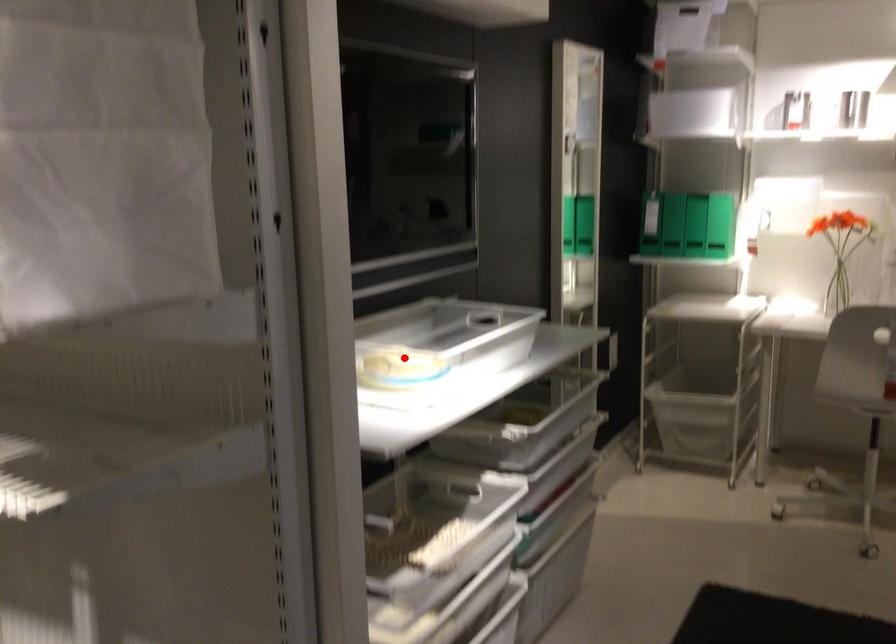
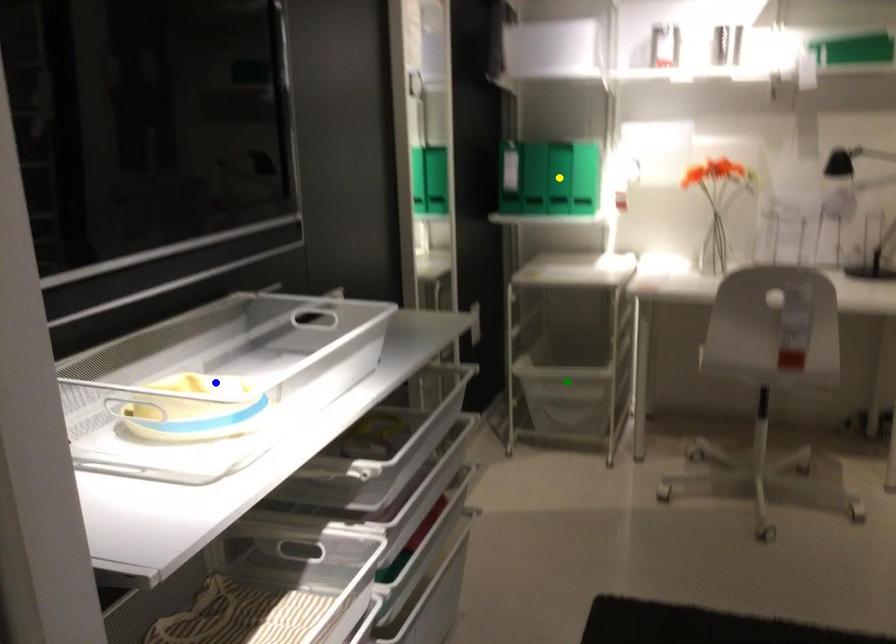
Question: I am providing you with two images of the same scene from different viewpoints. A red point is marked on the first image. You are given multiple points on the second image. In image 2, which mark is for the same physical point as the one in image 1?

Choices:
 (A) green point
 (B) blue point
 (C) yellow point

Answer: (B)